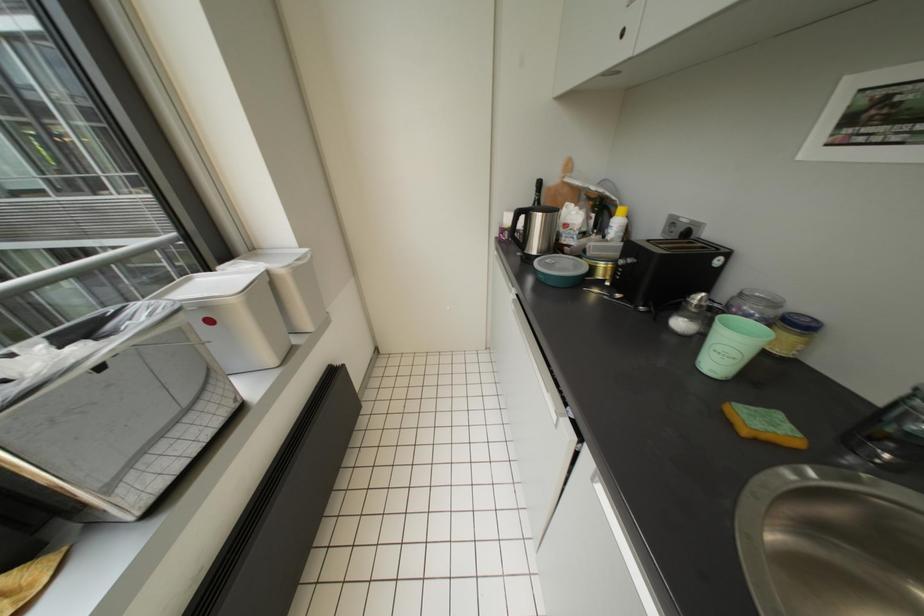
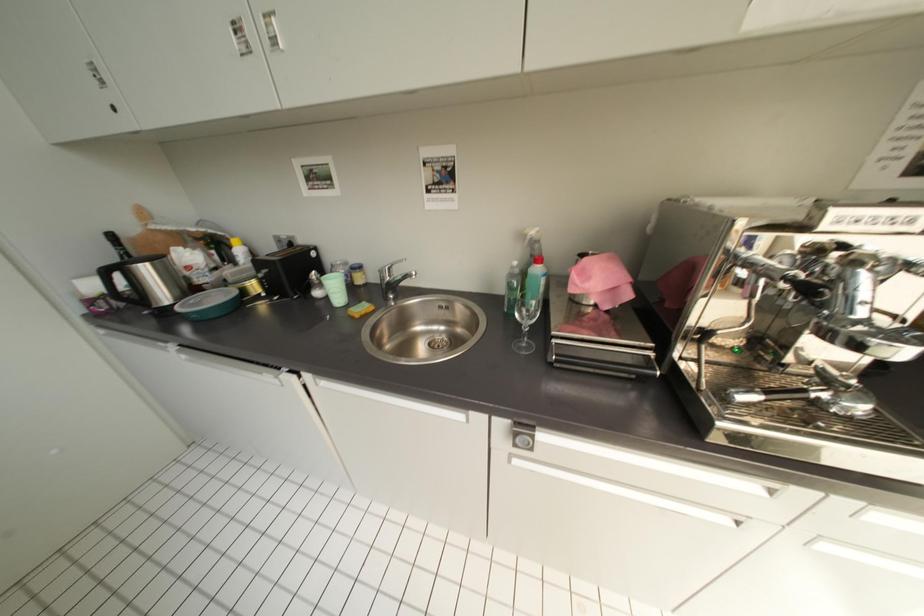
Question: The images are taken continuously from a first-person perspective. In which direction is your viewpoint rotating?

Choices:
 (A) Left
 (B) Right
 (C) Up
 (D) Down

Answer: (B)